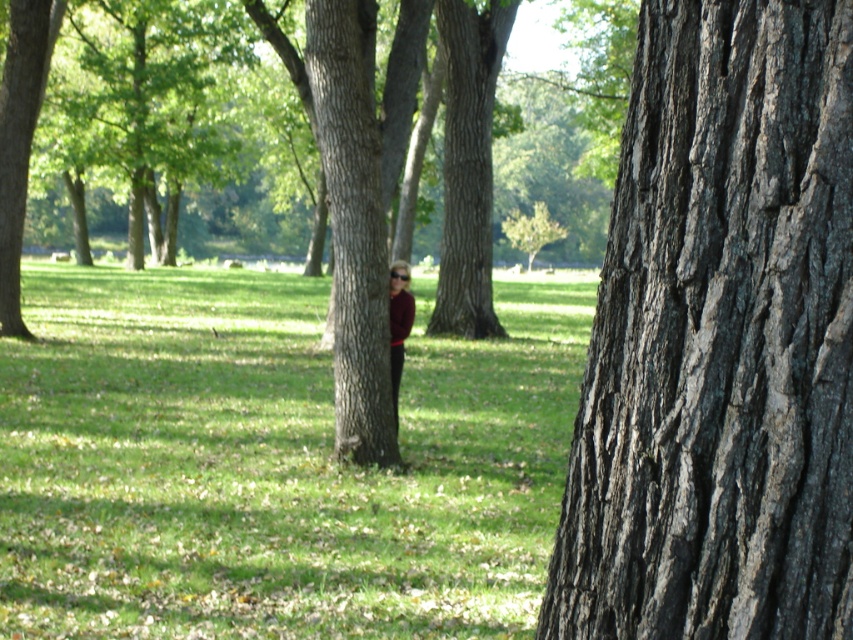
You are a photographer trying to capture a candid shot of the person in the maroon shirt at center without them noticing. Since the dark brown rough bark at center is blocking your view, can you estimate whether the bark is big enough to fully hide the person from your camera angle?

The dark brown rough bark at center is larger in size than the maroon shirt at center, so yes, the bark can fully hide the person wearing the maroon shirt at center from your camera angle.

You are standing in the park scene and want to move from the point at coordinates point (471, 406) to the point at coordinates point (564, 609). Which direction should you face to walk towards the second point?

You should face away from the viewer because point (564, 609) is further away than point 0.637, 0553.

You are standing at the origin point of the coordinate system in the park. You want to walk to the green grass at center. What are the coordinates you need to move to?

The coordinates to move to are point [271,464].